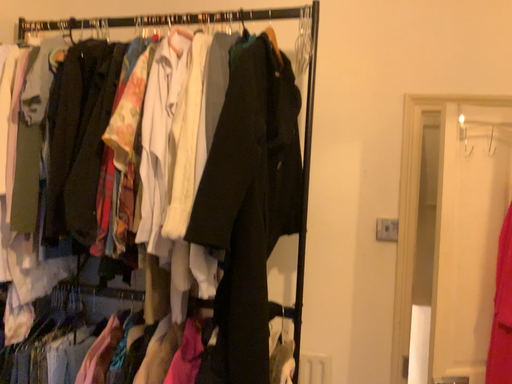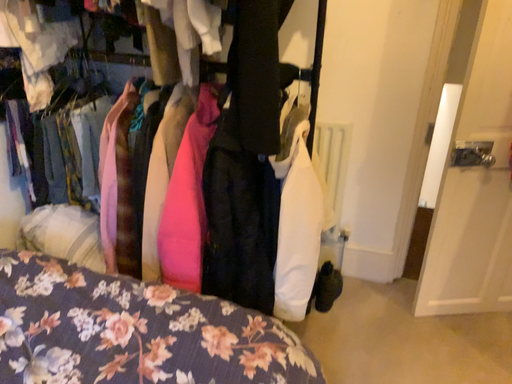
Question: How did the camera likely rotate when shooting the video?

Choices:
 (A) rotated downward
 (B) rotated upward

Answer: (A)